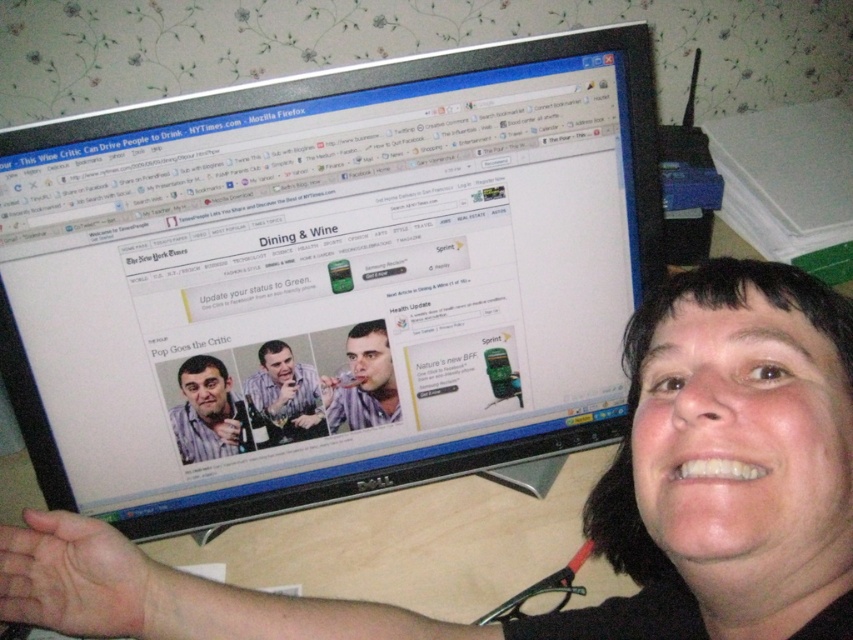
Can you confirm if matte white shirt at center is positioned to the right of matte black shirt at center?

Correct, you'll find matte white shirt at center to the right of matte black shirt at center.

Which is behind, point (337, 422) or point (315, 436)?

Point (337, 422)

Where is `matte white shirt at center`? The image size is (853, 640). matte white shirt at center is located at coordinates (363, 381).

Which of these two, black glossy monitor at upper center or matte black shirt at center, stands taller?

With more height is black glossy monitor at upper center.

Is black glossy monitor at upper center thinner than matte black shirt at center?

Incorrect, black glossy monitor at upper center's width is not less than matte black shirt at center's.

Identify the location of black glossy monitor at upper center. (331, 269).

Can you confirm if black matte face at lower right is thinner than matte white shirt at center?

No, black matte face at lower right is not thinner than matte white shirt at center.

Between black matte face at lower right and matte white shirt at center, which one has more height?

Standing taller between the two is black matte face at lower right.

Who is more forward, (723,262) or (341,376)?

Point (723,262)

Image resolution: width=853 pixels, height=640 pixels. What are the coordinates of `black matte face at lower right` in the screenshot? It's located at (587, 499).